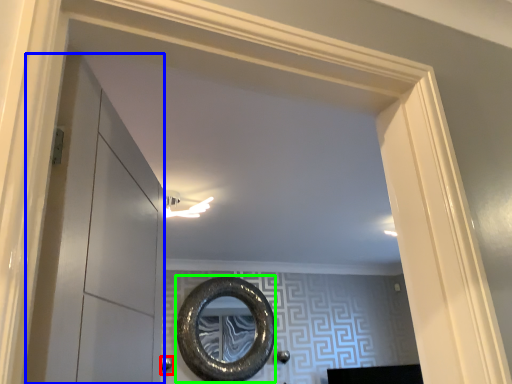
Question: Which object is the farthest from door handle (highlighted by a red box)? Choose among these: glass door (highlighted by a blue box) or oval (highlighted by a green box).

Choices:
 (A) glass door
 (B) oval

Answer: (A)